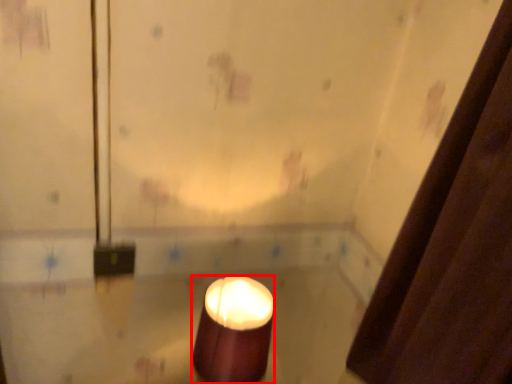
Question: From the image's perspective, considering the relative positions of candle (annotated by the red box) and shower curtain in the image provided, where is candle (annotated by the red box) located with respect to the staircase?

Choices:
 (A) below
 (B) above

Answer: (A)